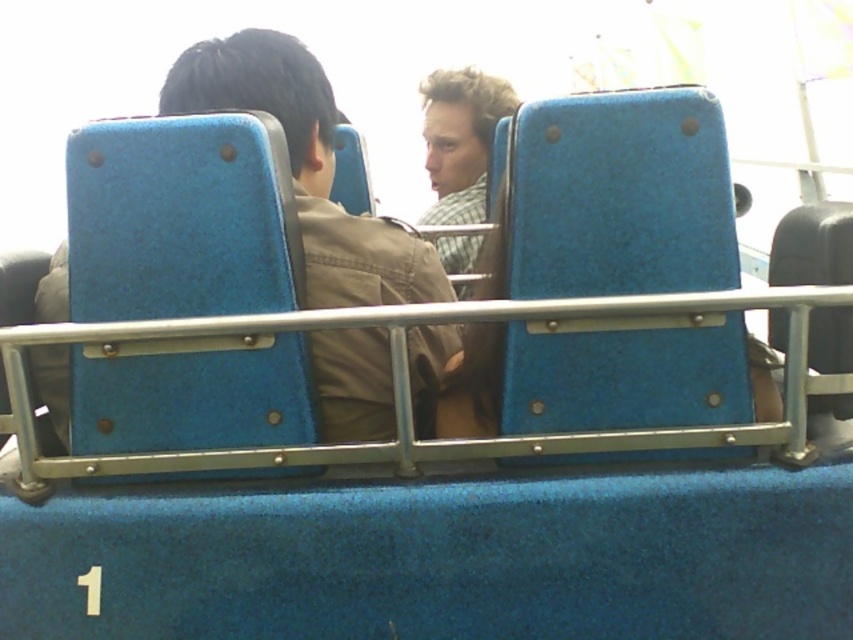
Is matte blue jacket at center to the right of checkered fabric shirt at center from the viewer's perspective?

No, matte blue jacket at center is not to the right of checkered fabric shirt at center.

The image size is (853, 640). I want to click on matte blue jacket at center, so (306, 168).